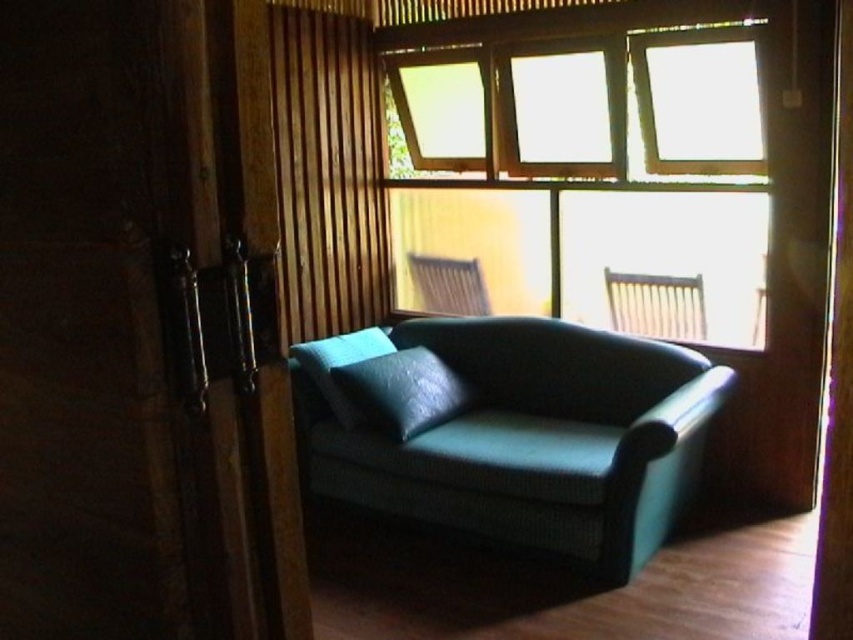
You are standing in the room and want to place a small plant between the two points marked as point (347, 426) and point (485, 301). Which point should the plant be closer to in order to be nearer to the viewer?

The plant should be placed closer to point (347, 426) because it is closer to the viewer than point (485, 301).

You are sitting on the dark green sofa and want to look outside through the transparent glass window at upper center. Is the teal fabric pillow at center blocking your view of the window?

The transparent glass window at upper center is closer to the viewer than the teal fabric pillow at center, so the pillow is not blocking the view of the window.

You are a guest in this room and want to sit on the teal fabric armchair at center. However, you notice the teal fabric pillow at center is in the way. Can you move the pillow to make space for the armchair?

The teal fabric pillow at center has a larger size compared to the teal fabric armchair at center, so moving the pillow might not be necessary as it is already positioned on the sofa. However, if you need to move it, its larger size could make it harder to move than the teal fabric armchair at center.